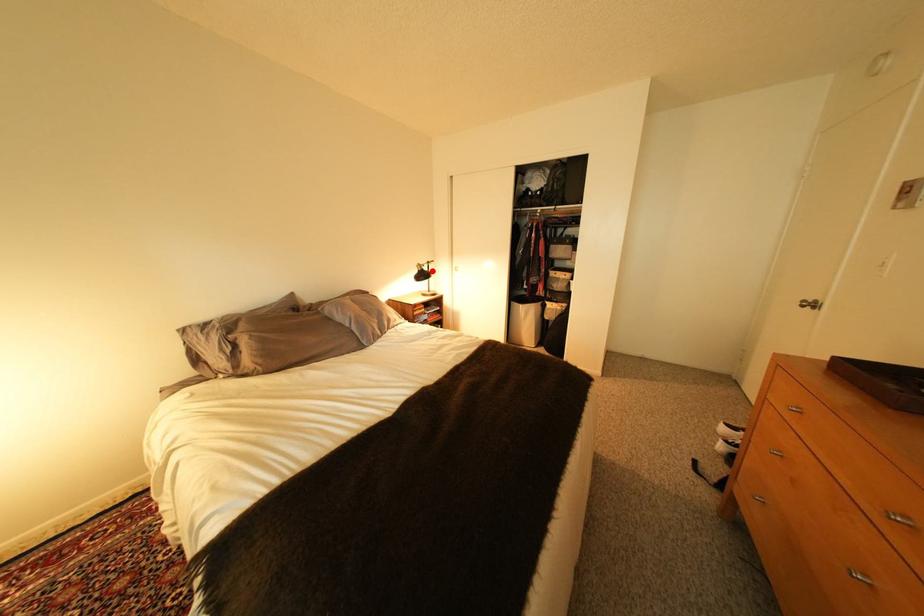
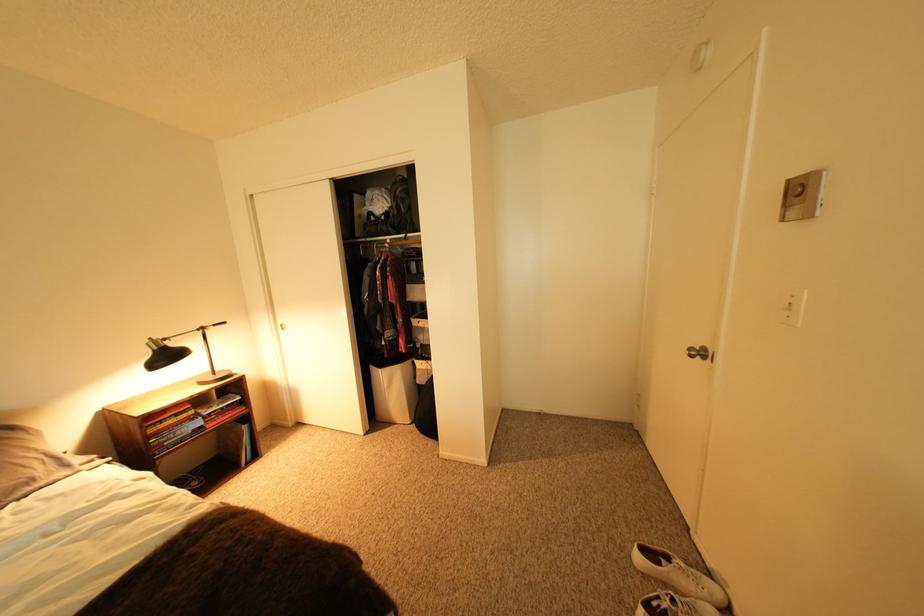
Find the pixel in the second image that matches the highlighted location in the first image.

(168, 350)